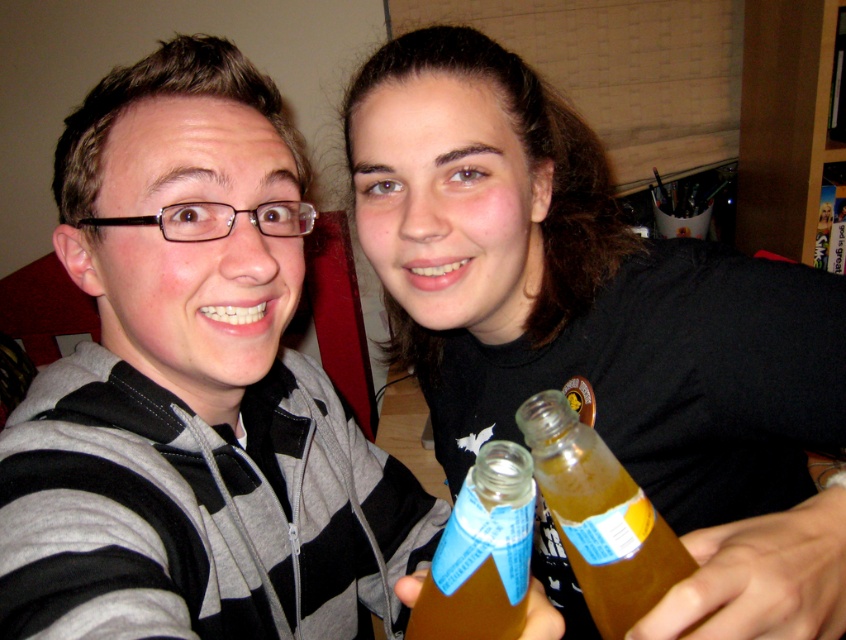
Question: Is translucent glass bottle at center wider than translucent plastic bottle at lower center?

Choices:
 (A) yes
 (B) no

Answer: (A)

Question: Which point appears closest to the camera in this image?

Choices:
 (A) (300, 237)
 (B) (718, 296)
 (C) (420, 593)
 (D) (561, 397)

Answer: (C)

Question: Which of the following is the closest to the observer?

Choices:
 (A) (107, 556)
 (B) (551, 417)

Answer: (B)

Question: Can you confirm if translucent glass bottle at center is positioned above translucent plastic bottle at lower center?

Choices:
 (A) yes
 (B) no

Answer: (A)

Question: Is gray striped hoodie at center thinner than translucent glass bottle at center?

Choices:
 (A) yes
 (B) no

Answer: (B)

Question: Which point is farther to the camera?

Choices:
 (A) translucent plastic bottle at lower center
 (B) black matte bottle at center

Answer: (A)